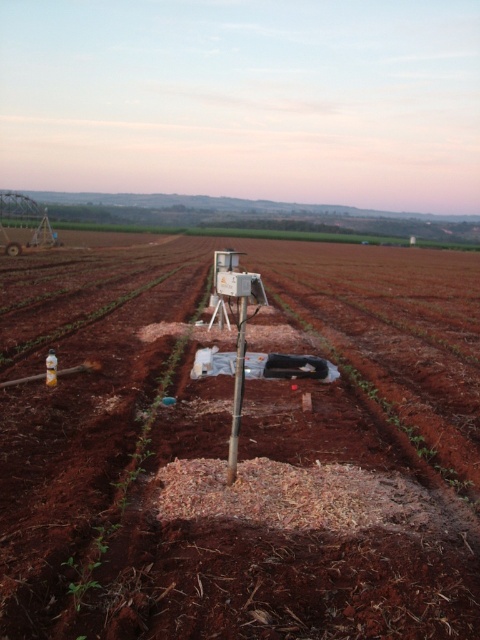
Does point (342, 524) come farther from viewer compared to point (232, 476)?

No, (342, 524) is in front of (232, 476).

Between brown soil at center and metallic pole at center, which one has more height?

Standing taller between the two is brown soil at center.

Which is in front, point (27, 509) or point (239, 400)?

Point (27, 509)

The image size is (480, 640). Identify the location of brown soil at center. (240, 449).